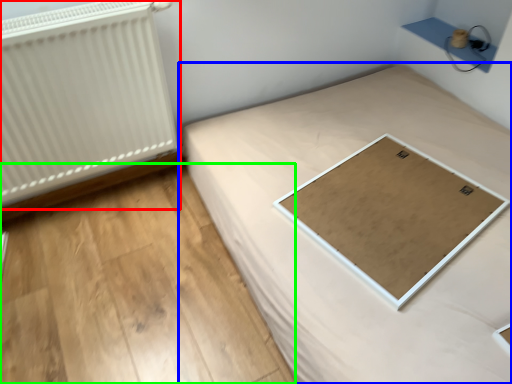
Question: Which object is the closest to the radiator (highlighted by a red box)? Choose among these: bed (highlighted by a blue box) or plywood (highlighted by a green box).

Choices:
 (A) bed
 (B) plywood

Answer: (B)